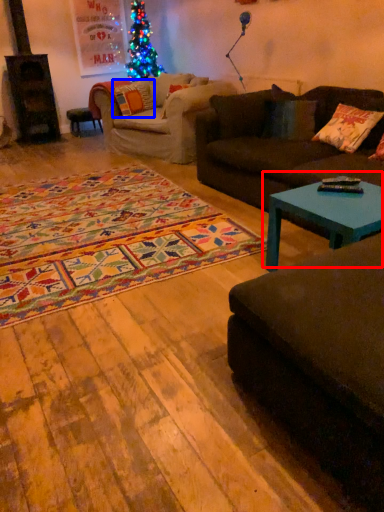
Question: Which of the following is the closest to the observer, coffee table (highlighted by a red box) or pillow (highlighted by a blue box)?

Choices:
 (A) coffee table
 (B) pillow

Answer: (A)